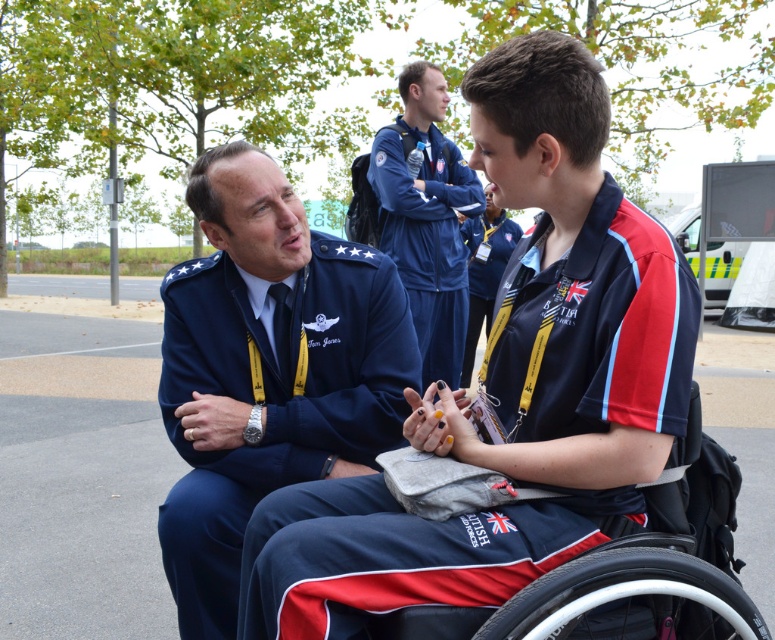
You are a photographer trying to capture a candid shot of the two people in the scene. You want to ensure that both the navy blue fabric uniform at center and the black plastic wheelchair at lower center are visible in the frame. Based on their positions, which object should you position closer to the left side of your camera viewfinder?

The navy blue fabric uniform at center should be positioned closer to the left side of the camera viewfinder since it is located to the left of the black plastic wheelchair at lower center in the scene.

Looking at this image, you are a tailor observing two garments at the center of your workspace. The navy blue fabric uniform at center and the blue fabric shirt at center. Which garment has a larger size?

The blue fabric shirt at center is larger than the navy blue fabric uniform at center.

Based on the coordinates provided, which object is located at point (x=274, y=401)?

The point (x=274, y=401) marks the navy blue fabric uniform at center.